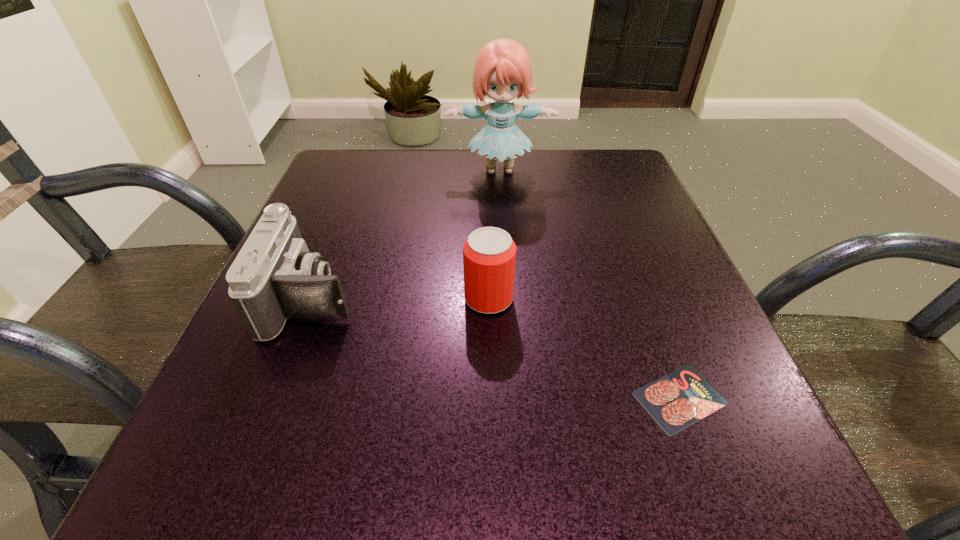
The width and height of the screenshot is (960, 540). In order to click on the farthest object in this screenshot , I will do `click(503, 71)`.

Identify the location of doll. Image resolution: width=960 pixels, height=540 pixels. [503, 71].

Locate an element on the screen. camera is located at coordinates (x=274, y=277).

I want to click on beer can, so click(489, 253).

Image resolution: width=960 pixels, height=540 pixels. I want to click on salami, so click(677, 400).

This screenshot has height=540, width=960. Identify the location of the rightmost object. (677, 400).

Where is `vacant space located 0.060m on the front-facing side of the doll`? vacant space located 0.060m on the front-facing side of the doll is located at coordinates (501, 200).

Identify the location of free region located 0.230m at the front of the camera with an open lens cover. The image size is (960, 540). (493, 298).

This screenshot has width=960, height=540. Find the location of `free space located on the left of the beer can`. free space located on the left of the beer can is located at coordinates (305, 299).

Identify the location of free region located on the back of the salami. This screenshot has height=540, width=960. (610, 210).